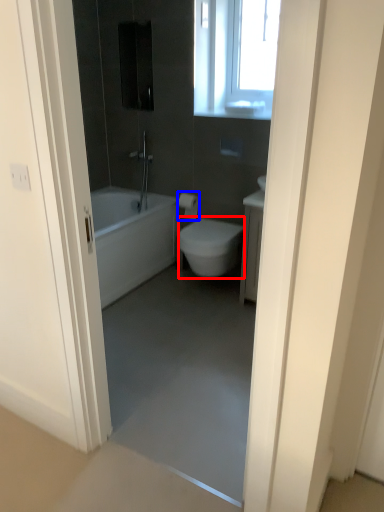
Question: Which object is further to the camera taking this photo, bidet (highlighted by a red box) or toilet paper (highlighted by a blue box)?

Choices:
 (A) bidet
 (B) toilet paper

Answer: (B)